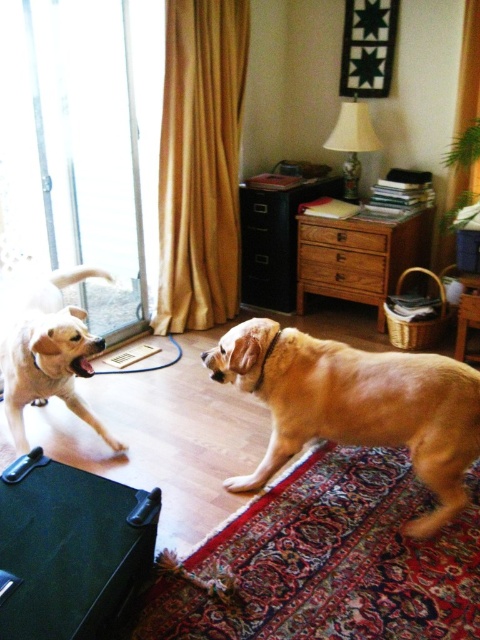
Question: Is transparent glass door at left smaller than golden fur dog at center?

Choices:
 (A) yes
 (B) no

Answer: (B)

Question: Is transparent glass door at left thinner than golden fur dog at left?

Choices:
 (A) yes
 (B) no

Answer: (B)

Question: Which of the following is the closest to the observer?

Choices:
 (A) (321, 253)
 (B) (121, 269)

Answer: (B)

Question: Among these points, which one is farthest from the camera?

Choices:
 (A) (363, 225)
 (B) (470, 401)
 (C) (98, 74)

Answer: (A)

Question: Which point appears farthest from the camera in this image?

Choices:
 (A) (279, 372)
 (B) (19, 340)
 (C) (321, 220)

Answer: (C)

Question: Is the position of golden fur dog at center more distant than that of wooden cabinet at center?

Choices:
 (A) yes
 (B) no

Answer: (B)